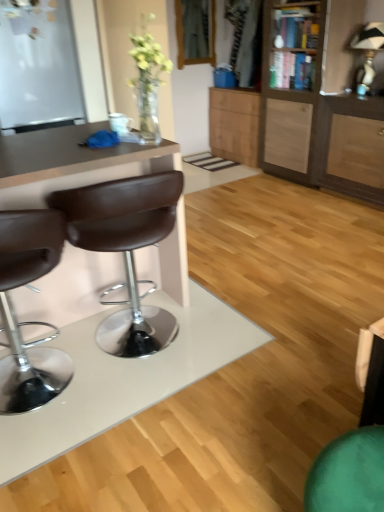
This screenshot has height=512, width=384. I want to click on wooden cabinet at center, which appears as the 1th cabinetry when viewed from the back, so click(234, 124).

Describe the element at coordinates (125, 249) in the screenshot. This screenshot has width=384, height=512. I see `brown leather stool at left, arranged as the 1th chair when viewed from the right` at that location.

Find the location of a particular element. wooden cabinet at right, placed as the first cabinetry when sorted from front to back is located at coordinates (318, 101).

What do you see at coordinates (15, 315) in the screenshot? I see `brown leather stool at left, the 1th chair positioned from the left` at bounding box center [15, 315].

I want to click on wooden cabinet at center, acting as the 2th cabinetry starting from the front, so point(234,124).

Consider the image. Who is shorter, brown leather stool at left, placed as the 2th chair when sorted from right to left, or brown leather stool at left, which appears as the 2th chair when viewed from the left?

brown leather stool at left, placed as the 2th chair when sorted from right to left.

How many degrees apart are the facing directions of brown leather stool at left, the 1th chair positioned from the left, and brown leather stool at left, arranged as the 1th chair when viewed from the right?

0.000307 degrees separate the facing orientations of brown leather stool at left, the 1th chair positioned from the left, and brown leather stool at left, arranged as the 1th chair when viewed from the right.

Is brown leather stool at left, placed as the 2th chair when sorted from right to left, not close to brown leather stool at left, which appears as the 2th chair when viewed from the left?

No, brown leather stool at left, placed as the 2th chair when sorted from right to left, is not far away from brown leather stool at left, which appears as the 2th chair when viewed from the left.

Is brown leather stool at left, the 1th chair positioned from the left, positioned behind brown leather stool at left, arranged as the 1th chair when viewed from the right?

No, it is not.

Can you confirm if brown leather stool at left, arranged as the 1th chair when viewed from the right, is bigger than wooden cabinet at right, the 2th cabinetry positioned from the back?

No.

Would you say brown leather stool at left, which appears as the 2th chair when viewed from the left, is to the left or to the right of wooden cabinet at right, placed as the first cabinetry when sorted from front to back, in the picture?

Clearly, brown leather stool at left, which appears as the 2th chair when viewed from the left, is on the left of wooden cabinet at right, placed as the first cabinetry when sorted from front to back, in the image.

Looking at this image, can you tell me how much brown leather stool at left, arranged as the 1th chair when viewed from the right, and wooden cabinet at right, placed as the first cabinetry when sorted from front to back, differ in facing direction?

88.2 degrees.

From the picture: Is white matte glass door at upper left positioned before brown leather desk at left?

No, white matte glass door at upper left is further to the viewer.

From a real-world perspective, is white matte glass door at upper left over brown leather desk at left?

Yes, from a real-world perspective, white matte glass door at upper left is over brown leather desk at left

Is white matte glass door at upper left outside of brown leather desk at left?

Yes, white matte glass door at upper left is not within brown leather desk at left.

From the picture: From the image's perspective, would you say white matte glass door at upper left is positioned over brown leather desk at left?

Indeed, from the image's perspective, white matte glass door at upper left is shown above brown leather desk at left.

Is the position of wooden cabinet at center, which appears as the 1th cabinetry when viewed from the back, more distant than that of brown leather stool at left, which appears as the 2th chair when viewed from the left?

Yes, the depth of wooden cabinet at center, which appears as the 1th cabinetry when viewed from the back, is greater than that of brown leather stool at left, which appears as the 2th chair when viewed from the left.

Can you see wooden cabinet at center, which appears as the 1th cabinetry when viewed from the back, touching brown leather stool at left, arranged as the 1th chair when viewed from the right?

wooden cabinet at center, which appears as the 1th cabinetry when viewed from the back, is not next to brown leather stool at left, arranged as the 1th chair when viewed from the right, and they're not touching.

Is brown leather stool at left, arranged as the 1th chair when viewed from the right, surrounded by wooden cabinet at center, which appears as the 1th cabinetry when viewed from the back?

No, wooden cabinet at center, which appears as the 1th cabinetry when viewed from the back, does not contain brown leather stool at left, arranged as the 1th chair when viewed from the right.

Is wooden cabinet at center, which appears as the 1th cabinetry when viewed from the back, positioned with its back to brown leather stool at left, which appears as the 2th chair when viewed from the left?

No, wooden cabinet at center, which appears as the 1th cabinetry when viewed from the back,'s orientation is not away from brown leather stool at left, which appears as the 2th chair when viewed from the left.

Considering the relative positions of wooden cabinet at center, which appears as the 1th cabinetry when viewed from the back, and brown leather stool at left, the 1th chair positioned from the left, in the image provided, is wooden cabinet at center, which appears as the 1th cabinetry when viewed from the back, to the right of brown leather stool at left, the 1th chair positioned from the left, from the viewer's perspective?

Correct, you'll find wooden cabinet at center, which appears as the 1th cabinetry when viewed from the back, to the right of brown leather stool at left, the 1th chair positioned from the left.

From the image's perspective, is wooden cabinet at center, acting as the 2th cabinetry starting from the front, over brown leather stool at left, the 1th chair positioned from the left?

Yes.

Is wooden cabinet at center, which appears as the 1th cabinetry when viewed from the back, beside brown leather stool at left, placed as the 2th chair when sorted from right to left?

There is a gap between wooden cabinet at center, which appears as the 1th cabinetry when viewed from the back, and brown leather stool at left, placed as the 2th chair when sorted from right to left.

Is wooden cabinet at center, acting as the 2th cabinetry starting from the front, bigger or smaller than brown leather stool at left, the 1th chair positioned from the left?

wooden cabinet at center, acting as the 2th cabinetry starting from the front, is bigger than brown leather stool at left, the 1th chair positioned from the left.

Is wooden cabinet at right, placed as the first cabinetry when sorted from front to back, closer to camera compared to brown leather desk at left?

No, the depth of wooden cabinet at right, placed as the first cabinetry when sorted from front to back, is greater than that of brown leather desk at left.

Is brown leather desk at left completely or partially inside wooden cabinet at right, placed as the first cabinetry when sorted from front to back?

No, brown leather desk at left is not surrounded by wooden cabinet at right, placed as the first cabinetry when sorted from front to back.

From a real-world perspective, is wooden cabinet at right, placed as the first cabinetry when sorted from front to back, positioned over brown leather desk at left based on gravity?

Yes.

Does point (307, 151) come behind point (167, 148)?

Yes, point (307, 151) is farther from viewer.

Is wooden cabinet at center, which appears as the 1th cabinetry when viewed from the back, smaller than wooden cabinet at right, placed as the first cabinetry when sorted from front to back?

Correct, wooden cabinet at center, which appears as the 1th cabinetry when viewed from the back, occupies less space than wooden cabinet at right, placed as the first cabinetry when sorted from front to back.

Is wooden cabinet at center, acting as the 2th cabinetry starting from the front, in front of or behind wooden cabinet at right, placed as the first cabinetry when sorted from front to back, in the image?

Clearly, wooden cabinet at center, acting as the 2th cabinetry starting from the front, is behind wooden cabinet at right, placed as the first cabinetry when sorted from front to back.

Can you confirm if wooden cabinet at center, which appears as the 1th cabinetry when viewed from the back, is taller than wooden cabinet at right, placed as the first cabinetry when sorted from front to back?

Incorrect, the height of wooden cabinet at center, which appears as the 1th cabinetry when viewed from the back, is not larger of that of wooden cabinet at right, placed as the first cabinetry when sorted from front to back.

I want to click on chair below the brown leather stool at left, arranged as the 1th chair when viewed from the right (from a real-world perspective), so click(15, 315).

Find the location of a particular element. The width and height of the screenshot is (384, 512). cabinetry that is the 2nd one when counting rightward from the brown leather stool at left, arranged as the 1th chair when viewed from the right is located at coordinates (318, 101).

Considering their positions, is wooden cabinet at right, the 2th cabinetry positioned from the back, positioned further to brown leather stool at left, placed as the 2th chair when sorted from right to left, than white matte glass door at upper left?

wooden cabinet at right, the 2th cabinetry positioned from the back, is positioned further to the anchor brown leather stool at left, placed as the 2th chair when sorted from right to left.

Estimate the real-world distances between objects in this image. Which object is further from brown leather desk at left, brown leather stool at left, the 1th chair positioned from the left, or wooden cabinet at center, acting as the 2th cabinetry starting from the front?

wooden cabinet at center, acting as the 2th cabinetry starting from the front.

Considering their positions, is brown leather stool at left, arranged as the 1th chair when viewed from the right, positioned closer to wooden cabinet at center, acting as the 2th cabinetry starting from the front, than brown leather desk at left?

Based on the image, brown leather desk at left appears to be nearer to wooden cabinet at center, acting as the 2th cabinetry starting from the front.

Which object lies nearer to the anchor point wooden cabinet at center, which appears as the 1th cabinetry when viewed from the back, brown leather stool at left, the 1th chair positioned from the left, or brown leather desk at left?

Among the two, brown leather desk at left is located nearer to wooden cabinet at center, which appears as the 1th cabinetry when viewed from the back.

From the image, which object appears to be farther from brown leather desk at left, brown leather stool at left, placed as the 2th chair when sorted from right to left, or wooden cabinet at right, placed as the first cabinetry when sorted from front to back?

Based on the image, wooden cabinet at right, placed as the first cabinetry when sorted from front to back, appears to be further to brown leather desk at left.

Based on their spatial positions, is brown leather desk at left or wooden cabinet at right, the 2th cabinetry positioned from the back, further from white matte glass door at upper left?

Among the two, wooden cabinet at right, the 2th cabinetry positioned from the back, is located further to white matte glass door at upper left.

Consider the image. Considering their positions, is wooden cabinet at right, placed as the first cabinetry when sorted from front to back, positioned further to brown leather desk at left than brown leather stool at left, which appears as the 2th chair when viewed from the left?

The object further to brown leather desk at left is wooden cabinet at right, placed as the first cabinetry when sorted from front to back.

Which object lies nearer to the anchor point wooden cabinet at right, the 2th cabinetry positioned from the back, brown leather stool at left, which appears as the 2th chair when viewed from the left, or wooden cabinet at center, which appears as the 1th cabinetry when viewed from the back?

The object closer to wooden cabinet at right, the 2th cabinetry positioned from the back, is wooden cabinet at center, which appears as the 1th cabinetry when viewed from the back.

Locate an element on the screen. The width and height of the screenshot is (384, 512). cabinetry between white matte glass door at upper left and wooden cabinet at right, placed as the first cabinetry when sorted from front to back, from left to right is located at coordinates (234, 124).

Image resolution: width=384 pixels, height=512 pixels. What are the coordinates of `desk between white matte glass door at upper left and brown leather stool at left, placed as the 2th chair when sorted from right to left, in the vertical direction` in the screenshot? It's located at (71, 163).

The height and width of the screenshot is (512, 384). What are the coordinates of `cabinetry between brown leather desk at left and wooden cabinet at center, which appears as the 1th cabinetry when viewed from the back, along the z-axis` in the screenshot? It's located at (318, 101).

Identify the location of desk positioned between brown leather stool at left, which appears as the 2th chair when viewed from the left, and wooden cabinet at center, acting as the 2th cabinetry starting from the front, from near to far. This screenshot has height=512, width=384. (71, 163).